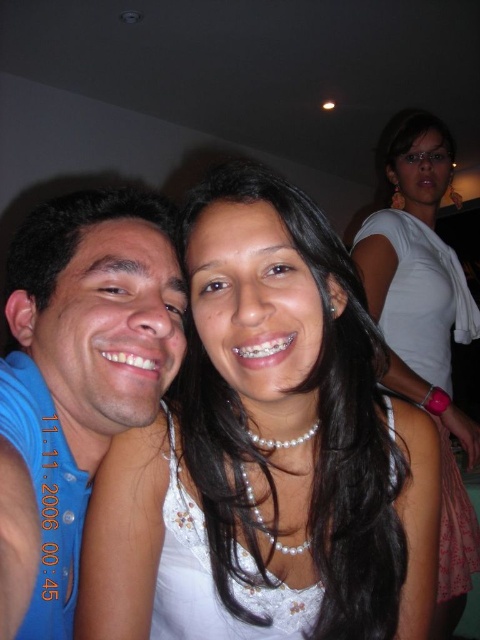
Question: Based on their relative distances, which object is nearer to the white pearl necklace at upper center?

Choices:
 (A) blue cotton shirt at left
 (B) pearl necklace at center

Answer: (B)

Question: Is pearl necklace at center below blue cotton shirt at left?

Choices:
 (A) no
 (B) yes

Answer: (B)

Question: Is pearl necklace at center below blue cotton shirt at left?

Choices:
 (A) yes
 (B) no

Answer: (A)

Question: Can you confirm if pearl necklace at center is positioned to the right of blue cotton shirt at left?

Choices:
 (A) yes
 (B) no

Answer: (A)

Question: Which point is farther from the camera taking this photo?

Choices:
 (A) (455, 609)
 (B) (41, 540)
 (C) (384, 433)

Answer: (A)

Question: Which point appears farthest from the camera in this image?

Choices:
 (A) (15, 292)
 (B) (223, 372)

Answer: (A)